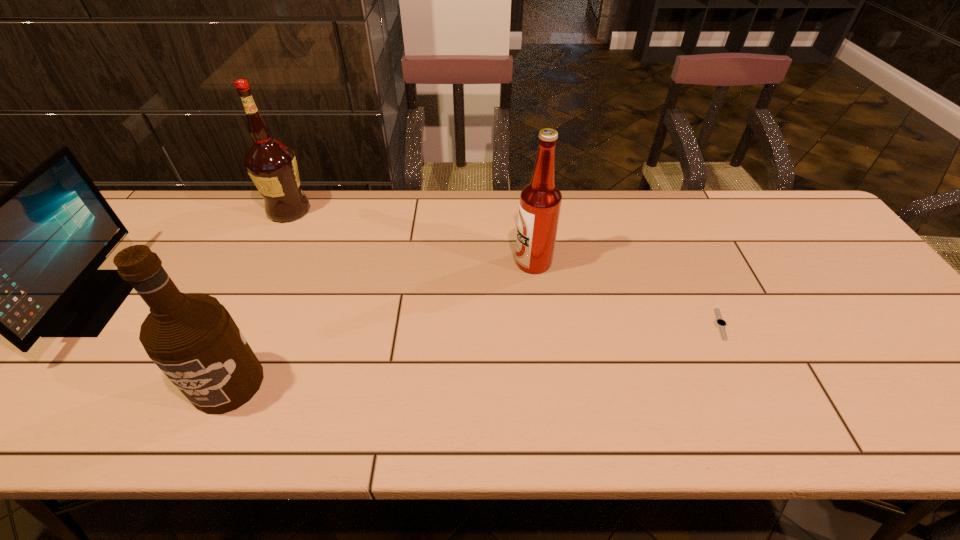
Locate an element on the screen. Image resolution: width=960 pixels, height=540 pixels. alcohol that is the second nearest to the nearest alcohol is located at coordinates (540, 202).

At what (x,y) coordinates should I click in order to perform the action: click on free location that satisfies the following two spatial constraints: 1. on the label of the rightmost object; 2. on the left side of the farthest object. Please return your answer as a coordinate pair (x, y). The width and height of the screenshot is (960, 540). Looking at the image, I should click on (233, 324).

At what (x,y) coordinates should I click in order to perform the action: click on free space that satisfies the following two spatial constraints: 1. on the screen side of the shortest object; 2. on the left side of the second shortest object. Please return your answer as a coordinate pair (x, y). Image resolution: width=960 pixels, height=540 pixels. Looking at the image, I should click on (80, 324).

I want to click on free point that satisfies the following two spatial constraints: 1. on the label side of the fourth object from left to right; 2. on the label of the nearest alcohol, so click(x=548, y=383).

The image size is (960, 540). Find the location of `free location that satisfies the following two spatial constraints: 1. on the label side of the second nearest alcohol; 2. on the back side of the watch`. free location that satisfies the following two spatial constraints: 1. on the label side of the second nearest alcohol; 2. on the back side of the watch is located at coordinates (540, 324).

Locate an element on the screen. This screenshot has height=540, width=960. free location that satisfies the following two spatial constraints: 1. on the screen side of the fourth tallest object; 2. on the back side of the shortest object is located at coordinates (80, 324).

You are a GUI agent. You are given a task and a screenshot of the screen. Output one action in this format:
    pyautogui.click(x=<x>, y=<y>)
    Task: Click on the free space that satisfies the following two spatial constraints: 1. on the label of the farthest object; 2. on the left side of the rightmost object
    This screenshot has width=960, height=540.
    Given the screenshot: What is the action you would take?
    pyautogui.click(x=233, y=324)

I want to click on free spot that satisfies the following two spatial constraints: 1. on the back side of the watch; 2. on the screen side of the leftmost object, so click(x=710, y=302).